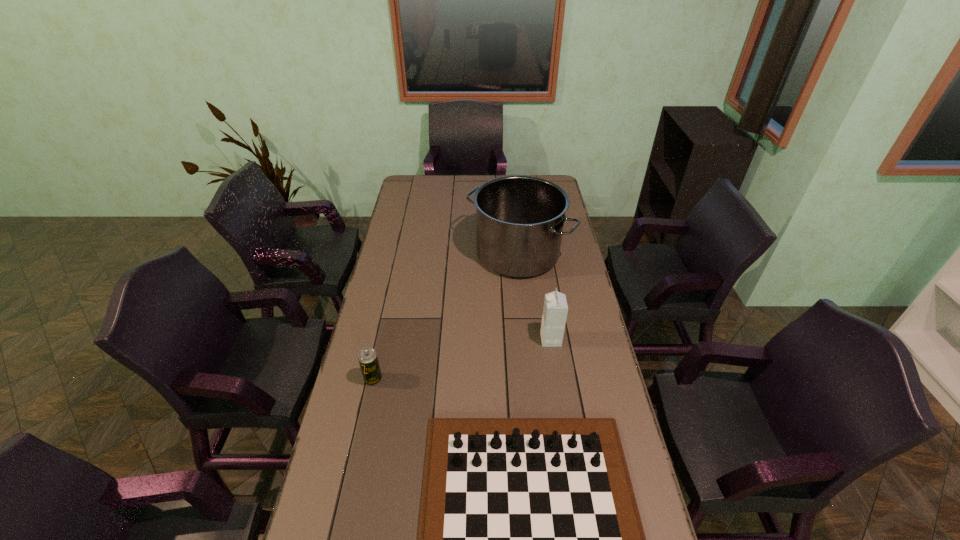
You are a GUI agent. You are given a task and a screenshot of the screen. Output one action in this format:
    pyautogui.click(x=<x>, y=<y>)
    Task: Click on the free region located 0.320m on the back of the second shortest object
    The height and width of the screenshot is (540, 960).
    Given the screenshot: What is the action you would take?
    pyautogui.click(x=390, y=302)

At what (x,y) coordinates should I click in order to perform the action: click on object situated at the left edge. Please return your answer as a coordinate pair (x, y). This screenshot has width=960, height=540. Looking at the image, I should click on (367, 357).

You are a GUI agent. You are given a task and a screenshot of the screen. Output one action in this format:
    pyautogui.click(x=<x>, y=<y>)
    Task: Click on the saucepan at the right edge
    
    Given the screenshot: What is the action you would take?
    pyautogui.click(x=519, y=219)

Where is `carton located at the right edge`? The width and height of the screenshot is (960, 540). carton located at the right edge is located at coordinates (555, 309).

The width and height of the screenshot is (960, 540). In the image, there is a desktop. Identify the location of vacant space at the left edge. (420, 206).

At what (x,y) coordinates should I click in order to perform the action: click on blank area at the right edge. Please return your answer as a coordinate pair (x, y). Looking at the image, I should click on (547, 272).

The height and width of the screenshot is (540, 960). In order to click on vacant region at the far left corner of the desktop in this screenshot , I will do `click(433, 186)`.

Where is `free space between the saucepan and the third shortest object`? The width and height of the screenshot is (960, 540). free space between the saucepan and the third shortest object is located at coordinates (534, 296).

Find the location of a particular element. This screenshot has width=960, height=540. free space that is in between the beer can and the farthest object is located at coordinates (445, 316).

Where is `vacant region between the second farthest object and the farthest object`? The width and height of the screenshot is (960, 540). vacant region between the second farthest object and the farthest object is located at coordinates point(534,296).